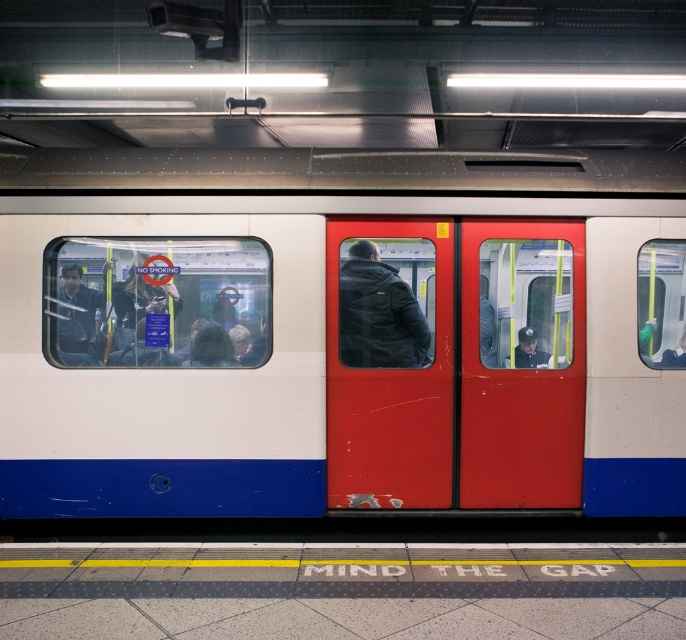
Measure the distance from dark blue leather jacket at center to matte black jacket at left.

dark blue leather jacket at center and matte black jacket at left are 6.39 feet apart from each other.

Is dark blue leather jacket at center above matte black jacket at left?

Correct, dark blue leather jacket at center is located above matte black jacket at left.

Is point (423, 365) positioned in front of point (70, 356)?

No, (423, 365) is behind (70, 356).

Find the location of `dark blue leather jacket at center`. dark blue leather jacket at center is located at coordinates (378, 314).

Is point (543, 365) positioned after point (528, 328)?

No, it is in front of (528, 328).

Can you confirm if metallic red door at center is positioned above dark blue uniform at center?

Incorrect, metallic red door at center is not positioned above dark blue uniform at center.

The width and height of the screenshot is (686, 640). What do you see at coordinates (521, 364) in the screenshot? I see `metallic red door at center` at bounding box center [521, 364].

Locate an element on the screen. The image size is (686, 640). metallic red door at center is located at coordinates (521, 364).

What do you see at coordinates (335, 337) in the screenshot? The height and width of the screenshot is (640, 686). I see `white glossy train at center` at bounding box center [335, 337].

Between point (206, 422) and point (523, 326), which one is positioned behind?

The point (523, 326) is behind.

This screenshot has width=686, height=640. What are the coordinates of `white glossy train at center` in the screenshot? It's located at (335, 337).